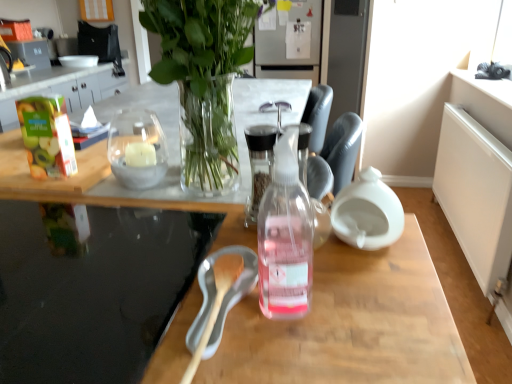
Question: Considering the relative positions of clear glass candle at center and transparent glass table at lower left in the image provided, is clear glass candle at center behind transparent glass table at lower left?

Choices:
 (A) no
 (B) yes

Answer: (B)

Question: From the image's perspective, is clear glass candle at center located beneath transparent glass table at lower left?

Choices:
 (A) yes
 (B) no

Answer: (B)

Question: From a real-world perspective, is clear glass candle at center positioned under transparent glass table at lower left based on gravity?

Choices:
 (A) no
 (B) yes

Answer: (A)

Question: From the image's perspective, does clear glass candle at center appear higher than transparent glass table at lower left?

Choices:
 (A) yes
 (B) no

Answer: (A)

Question: Can you confirm if clear glass candle at center is shorter than transparent glass table at lower left?

Choices:
 (A) yes
 (B) no

Answer: (B)

Question: Is transparent plastic bottle at center in front of or behind clear glass bottle at center in the image?

Choices:
 (A) behind
 (B) front

Answer: (B)

Question: Is transparent plastic bottle at center to the left or to the right of clear glass bottle at center in the image?

Choices:
 (A) right
 (B) left

Answer: (B)

Question: Is transparent plastic bottle at center wider or thinner than clear glass bottle at center?

Choices:
 (A) wide
 (B) thin

Answer: (A)

Question: Choose the correct answer: Is transparent plastic bottle at center inside clear glass bottle at center or outside it?

Choices:
 (A) outside
 (B) inside

Answer: (A)

Question: Is transparent glass table at lower left inside the boundaries of clear glass vase at upper center, or outside?

Choices:
 (A) inside
 (B) outside

Answer: (B)

Question: From a real-world perspective, relative to clear glass vase at upper center, is transparent glass table at lower left vertically above or below?

Choices:
 (A) above
 (B) below

Answer: (B)

Question: From the image's perspective, is transparent glass table at lower left positioned above or below clear glass vase at upper center?

Choices:
 (A) above
 (B) below

Answer: (B)

Question: Would you say transparent glass table at lower left is to the left or to the right of clear glass vase at upper center in the picture?

Choices:
 (A) left
 (B) right

Answer: (A)

Question: From a real-world perspective, is transparent plastic bottle at center above or below clear glass candle at center?

Choices:
 (A) below
 (B) above

Answer: (A)

Question: In terms of height, does transparent plastic bottle at center look taller or shorter compared to clear glass candle at center?

Choices:
 (A) short
 (B) tall

Answer: (B)